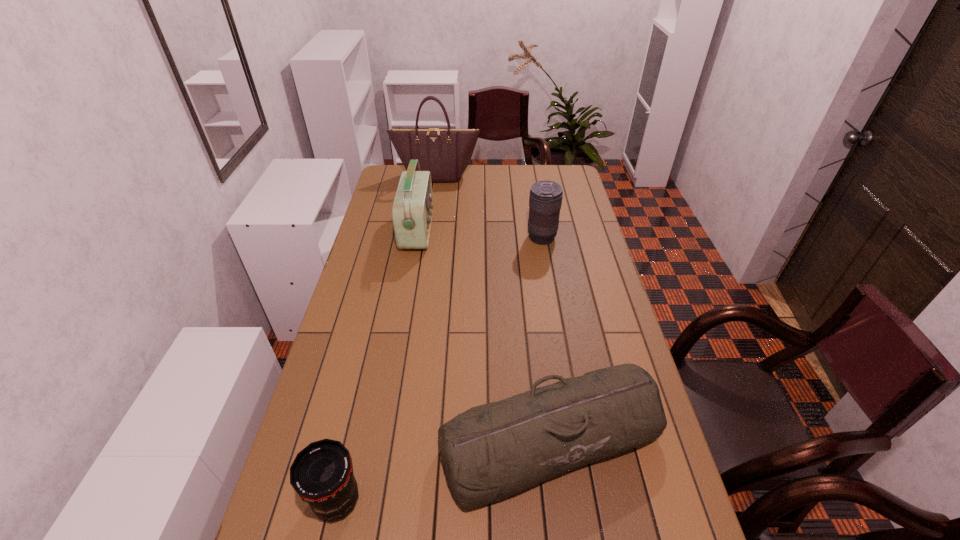
At what (x,y) coordinates should I click in order to perform the action: click on the tallest object. Please return your answer as a coordinate pair (x, y). Looking at the image, I should click on pyautogui.click(x=446, y=153).

At what (x,y) coordinates should I click in order to perform the action: click on handbag. Please return your answer as a coordinate pair (x, y). This screenshot has height=540, width=960. Looking at the image, I should click on pos(446,153).

The height and width of the screenshot is (540, 960). What are the coordinates of `radio receiver` in the screenshot? It's located at (412, 210).

This screenshot has width=960, height=540. Identify the location of the taller telephoto lens. (545, 199).

The image size is (960, 540). In order to click on the right telephoto lens in this screenshot , I will do `click(545, 199)`.

This screenshot has height=540, width=960. In order to click on duffel bag in this screenshot , I will do `click(492, 451)`.

Where is `the shorter telephoto lens`? The image size is (960, 540). the shorter telephoto lens is located at coordinates (321, 474).

You are a GUI agent. You are given a task and a screenshot of the screen. Output one action in this format:
    pyautogui.click(x=<x>, y=<y>)
    Task: Click on the left telephoto lens
    The height and width of the screenshot is (540, 960).
    Given the screenshot: What is the action you would take?
    pyautogui.click(x=321, y=474)

The width and height of the screenshot is (960, 540). Identify the location of vacant space located on the front-facing side of the farthest object. (430, 218).

Where is `vacant space situated on the front panel of the fourth shortest object`? The height and width of the screenshot is (540, 960). vacant space situated on the front panel of the fourth shortest object is located at coordinates (527, 231).